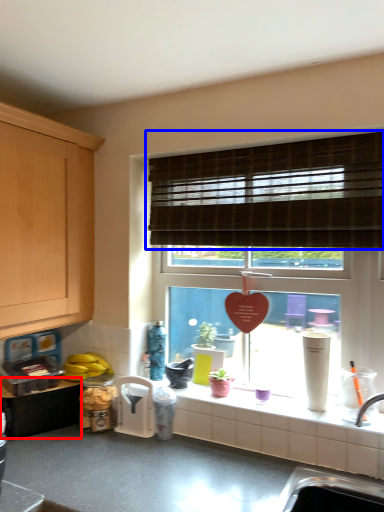
Question: Which point is closer to the camera, cabinetry (highlighted by a red box) or window blind (highlighted by a blue box)?

Choices:
 (A) cabinetry
 (B) window blind

Answer: (B)